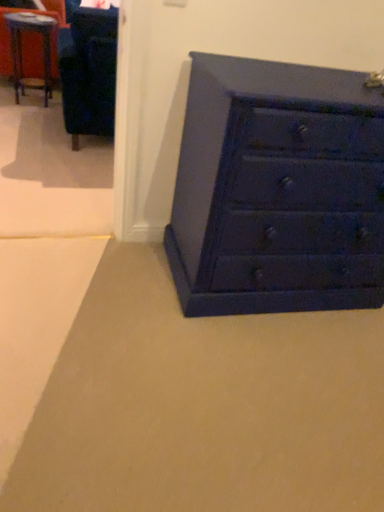
What do you see at coordinates (88, 71) in the screenshot? I see `velvet blue armchair at upper left` at bounding box center [88, 71].

Image resolution: width=384 pixels, height=512 pixels. I want to click on matte blue chest of drawers at lower right, so click(277, 190).

This screenshot has width=384, height=512. What are the coordinates of `velvet blue armchair at upper left` in the screenshot? It's located at (88, 71).

In terms of width, does matte blue chest of drawers at lower right look wider or thinner when compared to velvet blue armchair at upper left?

Considering their sizes, matte blue chest of drawers at lower right looks slimmer than velvet blue armchair at upper left.

Considering the relative positions of matte blue chest of drawers at lower right and velvet blue armchair at upper left in the image provided, is matte blue chest of drawers at lower right to the left of velvet blue armchair at upper left from the viewer's perspective?

Incorrect, matte blue chest of drawers at lower right is not on the left side of velvet blue armchair at upper left.

Can you confirm if matte blue chest of drawers at lower right is taller than velvet blue armchair at upper left?

Correct, matte blue chest of drawers at lower right is much taller as velvet blue armchair at upper left.

In the scene shown: Is matte blue chest of drawers at lower right not close to velvet blue armchair at upper left?

Yes, matte blue chest of drawers at lower right is far from velvet blue armchair at upper left.

At what (x,y) coordinates should I click in order to perform the action: click on table directly beneath the velvet blue armchair at upper left (from a real-world perspective). Please return your answer as a coordinate pair (x, y). The width and height of the screenshot is (384, 512). Looking at the image, I should click on (39, 50).

Can you confirm if metallic blue table at upper left is positioned to the left of velvet blue armchair at upper left?

Yes, metallic blue table at upper left is to the left of velvet blue armchair at upper left.

Which is correct: metallic blue table at upper left is inside velvet blue armchair at upper left, or outside of it?

metallic blue table at upper left is outside velvet blue armchair at upper left.

Locate an element on the screen. chest of drawers on the right of velvet blue armchair at upper left is located at coordinates tap(277, 190).

Could you tell me if velvet blue armchair at upper left is facing matte blue chest of drawers at lower right?

No, velvet blue armchair at upper left is not turned towards matte blue chest of drawers at lower right.

How far apart are velvet blue armchair at upper left and matte blue chest of drawers at lower right?

A distance of 1.47 meters exists between velvet blue armchair at upper left and matte blue chest of drawers at lower right.

Which is more to the left, velvet blue armchair at upper left or matte blue chest of drawers at lower right?

From the viewer's perspective, velvet blue armchair at upper left appears more on the left side.

Which object is positioned more to the left, velvet blue armchair at upper left or metallic blue table at upper left?

metallic blue table at upper left.

Is velvet blue armchair at upper left positioned far away from metallic blue table at upper left?

Yes.

Can metallic blue table at upper left be found inside velvet blue armchair at upper left?

No, velvet blue armchair at upper left does not contain metallic blue table at upper left.

Between velvet blue armchair at upper left and metallic blue table at upper left, which one has larger width?

velvet blue armchair at upper left.

Are matte blue chest of drawers at lower right and metallic blue table at upper left located far from each other?

Yes, matte blue chest of drawers at lower right is far from metallic blue table at upper left.

Does matte blue chest of drawers at lower right have a greater height compared to metallic blue table at upper left?

Indeed, matte blue chest of drawers at lower right has a greater height compared to metallic blue table at upper left.

Between matte blue chest of drawers at lower right and metallic blue table at upper left, which one has smaller width?

metallic blue table at upper left.

Consider the image. From a real-world perspective, is matte blue chest of drawers at lower right above or below metallic blue table at upper left?

matte blue chest of drawers at lower right is above metallic blue table at upper left.

Does metallic blue table at upper left have a greater width compared to matte blue chest of drawers at lower right?

No, metallic blue table at upper left is not wider than matte blue chest of drawers at lower right.

Which of these two, metallic blue table at upper left or matte blue chest of drawers at lower right, stands taller?

Standing taller between the two is matte blue chest of drawers at lower right.

Is metallic blue table at upper left looking in the opposite direction of matte blue chest of drawers at lower right?

metallic blue table at upper left is not turned away from matte blue chest of drawers at lower right.

Based on their sizes in the image, would you say metallic blue table at upper left is bigger or smaller than matte blue chest of drawers at lower right?

Considering their sizes, metallic blue table at upper left takes up less space than matte blue chest of drawers at lower right.

What are the coordinates of `furniture that is above the matte blue chest of drawers at lower right (from the image's perspective)` in the screenshot? It's located at (88, 71).

In the image, there is a velvet blue armchair at upper left. At what (x,y) coordinates should I click in order to perform the action: click on table below it (from a real-world perspective). Please return your answer as a coordinate pair (x, y). The height and width of the screenshot is (512, 384). Looking at the image, I should click on (39, 50).

Which object lies nearer to the anchor point velvet blue armchair at upper left, metallic blue table at upper left or matte blue chest of drawers at lower right?

metallic blue table at upper left is closer to velvet blue armchair at upper left.

Which object lies nearer to the anchor point matte blue chest of drawers at lower right, metallic blue table at upper left or velvet blue armchair at upper left?

velvet blue armchair at upper left lies closer to matte blue chest of drawers at lower right than the other object.

From the image, which object appears to be nearer to matte blue chest of drawers at lower right, velvet blue armchair at upper left or metallic blue table at upper left?

velvet blue armchair at upper left.

Considering their positions, is matte blue chest of drawers at lower right positioned closer to metallic blue table at upper left than velvet blue armchair at upper left?

velvet blue armchair at upper left lies closer to metallic blue table at upper left than the other object.

Considering their positions, is velvet blue armchair at upper left positioned closer to metallic blue table at upper left than matte blue chest of drawers at lower right?

Based on the image, velvet blue armchair at upper left appears to be nearer to metallic blue table at upper left.

Which object lies further to the anchor point velvet blue armchair at upper left, matte blue chest of drawers at lower right or metallic blue table at upper left?

Among the two, matte blue chest of drawers at lower right is located further to velvet blue armchair at upper left.

Where is `furniture positioned between matte blue chest of drawers at lower right and metallic blue table at upper left from near to far`? The image size is (384, 512). furniture positioned between matte blue chest of drawers at lower right and metallic blue table at upper left from near to far is located at coordinates (88, 71).